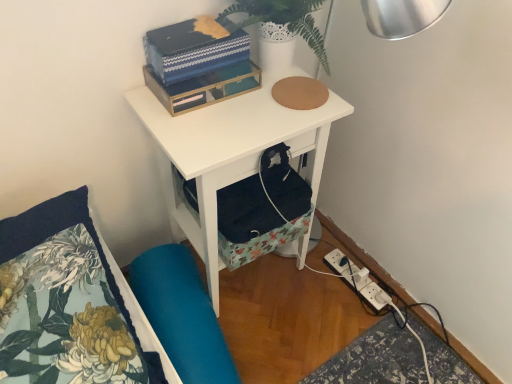
At what (x,y) coordinates should I click in order to perform the action: click on free space on the front side of blue textured box at upper center. Please return your answer as a coordinate pair (x, y). The width and height of the screenshot is (512, 384). Looking at the image, I should click on (207, 126).